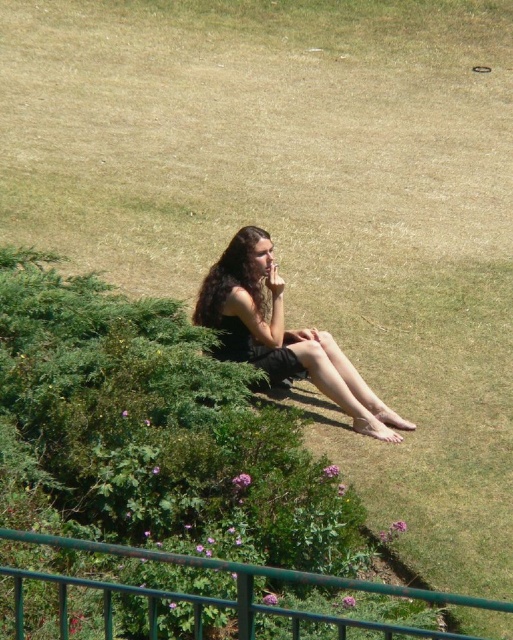
Consider the image. Please provide the exact 2D coordinates of the dark brown hair at center in the image.

The dark brown hair at center is located at coordinates (283, 333).

Looking at this image, you are a drone operator trying to capture a photo of the dark brown hair at center and green metal railing at lower center from above. What is the minimum distance between the two objects you need to maintain in your shot to ensure both are clearly visible?

The minimum distance between the dark brown hair at center and the green metal railing at lower center that must be maintained in the shot is 3.59 meters to ensure both are clearly visible.

You are a photographer trying to capture the scene with a wide angle lens. You notice the dark brown hair at center and the green metal railing at lower center. Which object appears narrower in the photo?

The dark brown hair at center appears narrower because it has a lesser width compared to the green metal railing at lower center.